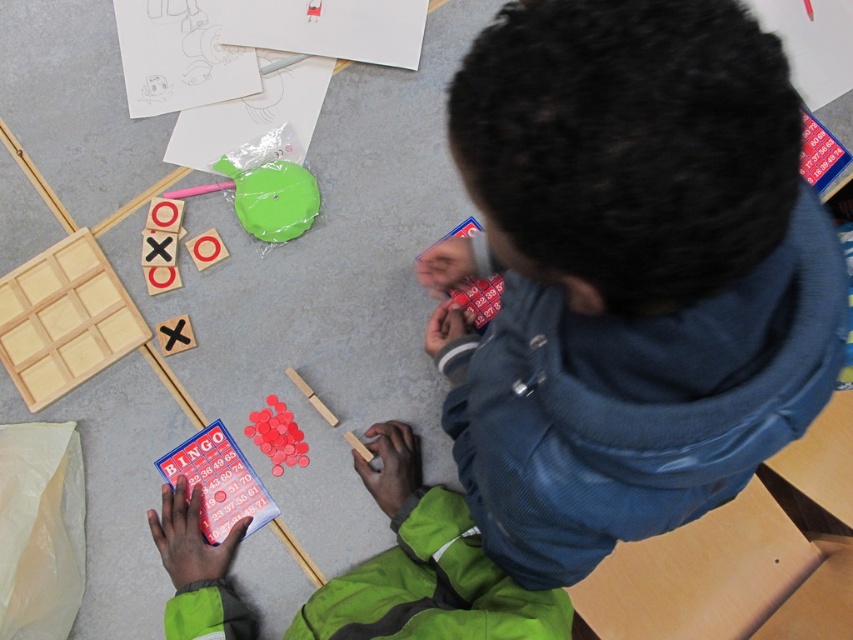
You are a robot standing 1.2 meters away from the point at coordinates point (294, 220). Can you reach that point without moving closer?

The distance of point (294, 220) from viewer is 1.02 meters, so yes, the robot can reach that point without moving closer since it is within the robot arm length.

You are a child trying to place the smooth red bingo chips at center into the green plastic lid at upper center. Can you fit all the chips into the lid?

The green plastic lid at upper center is bigger than smooth red bingo chips at center, so yes, you can fit all the chips into the lid since it has enough space.